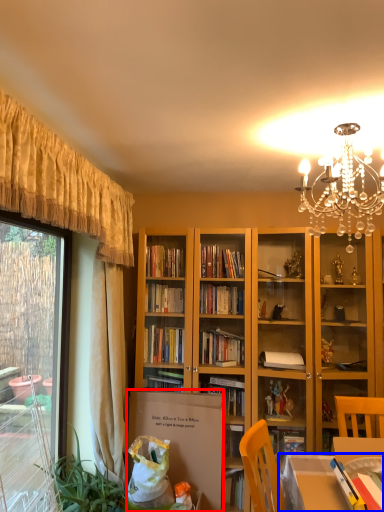
Question: Which of the following is the farthest to the observer, cardboard box (highlighted by a red box) or table (highlighted by a blue box)?

Choices:
 (A) cardboard box
 (B) table

Answer: (A)